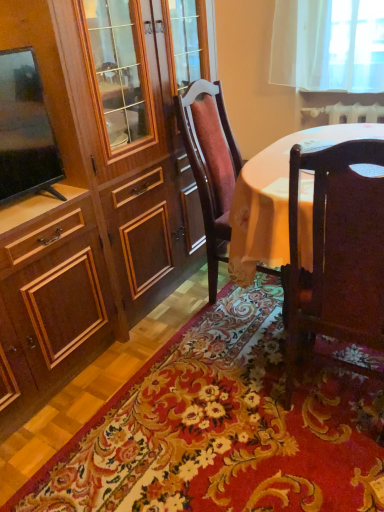
Question: Does wooden chair at center, which ranks as the 2th chair in front-to-back order, turn towards dark wood chair at lower right, arranged as the 2th chair when viewed from the back?

Choices:
 (A) no
 (B) yes

Answer: (A)

Question: Does wooden chair at center, which ranks as the 2th chair in front-to-back order, appear on the right side of dark wood chair at lower right, the first chair from the front?

Choices:
 (A) no
 (B) yes

Answer: (A)

Question: Is wooden chair at center, which ranks as the 2th chair in front-to-back order, further to the viewer compared to dark wood chair at lower right, arranged as the 2th chair when viewed from the back?

Choices:
 (A) yes
 (B) no

Answer: (A)

Question: From the image's perspective, is wooden chair at center, placed as the 1th chair when sorted from back to front, above dark wood chair at lower right, arranged as the 2th chair when viewed from the back?

Choices:
 (A) no
 (B) yes

Answer: (B)

Question: From a real-world perspective, is wooden chair at center, which ranks as the 2th chair in front-to-back order, under dark wood chair at lower right, arranged as the 2th chair when viewed from the back?

Choices:
 (A) yes
 (B) no

Answer: (B)

Question: From their relative heights in the image, would you say dark wood chair at lower right, the first chair from the front, is taller or shorter than wooden chair at center, which ranks as the 2th chair in front-to-back order?

Choices:
 (A) short
 (B) tall

Answer: (A)

Question: Based on their positions, is dark wood chair at lower right, arranged as the 2th chair when viewed from the back, located to the left or right of wooden chair at center, placed as the 1th chair when sorted from back to front?

Choices:
 (A) right
 (B) left

Answer: (A)

Question: From the image's perspective, is dark wood chair at lower right, arranged as the 2th chair when viewed from the back, located above or below wooden chair at center, which ranks as the 2th chair in front-to-back order?

Choices:
 (A) above
 (B) below

Answer: (B)

Question: Looking at the image, does dark wood chair at lower right, the first chair from the front, seem bigger or smaller compared to wooden chair at center, placed as the 1th chair when sorted from back to front?

Choices:
 (A) big
 (B) small

Answer: (B)

Question: Considering the positions of matte black tv at left and dark wood chair at lower right, the first chair from the front, in the image, is matte black tv at left wider or thinner than dark wood chair at lower right, the first chair from the front,?

Choices:
 (A) thin
 (B) wide

Answer: (A)

Question: From a real-world perspective, is matte black tv at left above or below dark wood chair at lower right, arranged as the 2th chair when viewed from the back?

Choices:
 (A) above
 (B) below

Answer: (A)

Question: Is point (11, 104) closer or farther from the camera than point (364, 293)?

Choices:
 (A) farther
 (B) closer

Answer: (A)

Question: From the image's perspective, is matte black tv at left above or below dark wood chair at lower right, arranged as the 2th chair when viewed from the back?

Choices:
 (A) above
 (B) below

Answer: (A)

Question: Is point (210, 183) positioned closer to the camera than point (297, 395)?

Choices:
 (A) closer
 (B) farther

Answer: (B)

Question: From a real-world perspective, is wooden chair at center, placed as the 1th chair when sorted from back to front, positioned above or below floral carpet at center?

Choices:
 (A) above
 (B) below

Answer: (A)